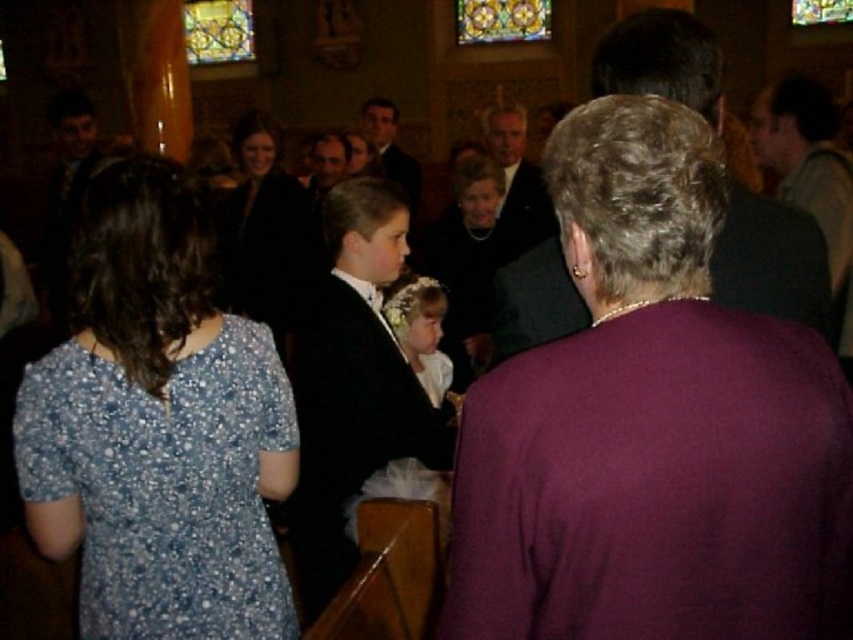
You are a photographer inside the church and need to capture a photo of both the black satin suit at center and the black satin dress at center. Which one is positioned lower in the frame?

The black satin suit at center is below the black satin dress at center, so the black satin suit at center is positioned lower in the frame.

You are a photographer trying to capture a clear shot of both the black satin dress at center and the pearl necklace at center. Which object should you focus on first to ensure it appears sharp in the photo?

The black satin dress at center is closer to the viewer than the pearl necklace at center, so focusing on the black satin dress at center first will ensure it appears sharp. Since the pearl necklace at center is farther away, adjusting the focus afterward might be necessary for it to be clear.

You are a photographer trying to capture a group photo of the formal suit at center and the matte black suit at center. Which one should you focus on first if you want to ensure the larger one is in sharp focus?

The formal suit at center is bigger than the matte black suit at center, so you should focus on the formal suit at center first to ensure it is in sharp focus.